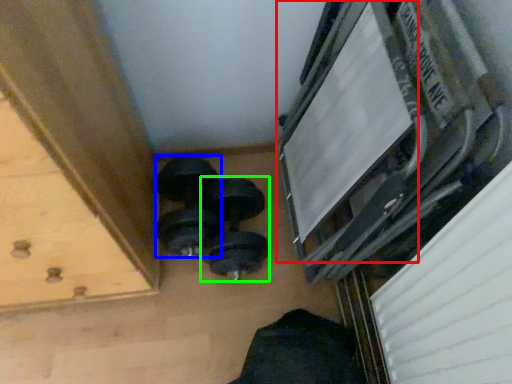
Question: Based on their relative distances, which object is farther from window frame (highlighted by a red box)? Choose from dumbbell (highlighted by a blue box) and dumbbell (highlighted by a green box).

Choices:
 (A) dumbbell
 (B) dumbbell

Answer: (A)